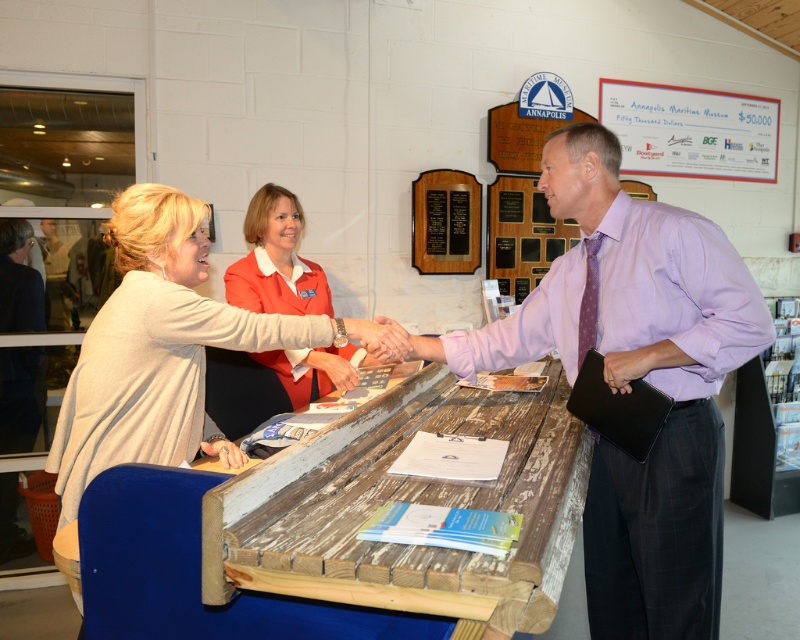
Does weathered wood table at center appear on the right side of light beige sweater at center?

Correct, you'll find weathered wood table at center to the right of light beige sweater at center.

This screenshot has width=800, height=640. I want to click on weathered wood table at center, so click(x=408, y=499).

Which is below, purple shirt at center or weathered wood table at center?

Positioned lower is weathered wood table at center.

This screenshot has height=640, width=800. What do you see at coordinates (636, 378) in the screenshot?
I see `purple shirt at center` at bounding box center [636, 378].

Find the location of a particular element. purple shirt at center is located at coordinates (636, 378).

Between purple shirt at center and light beige sweater at center, which one has more height?

Standing taller between the two is purple shirt at center.

Find the location of a particular element. This screenshot has height=640, width=800. purple shirt at center is located at coordinates click(x=636, y=378).